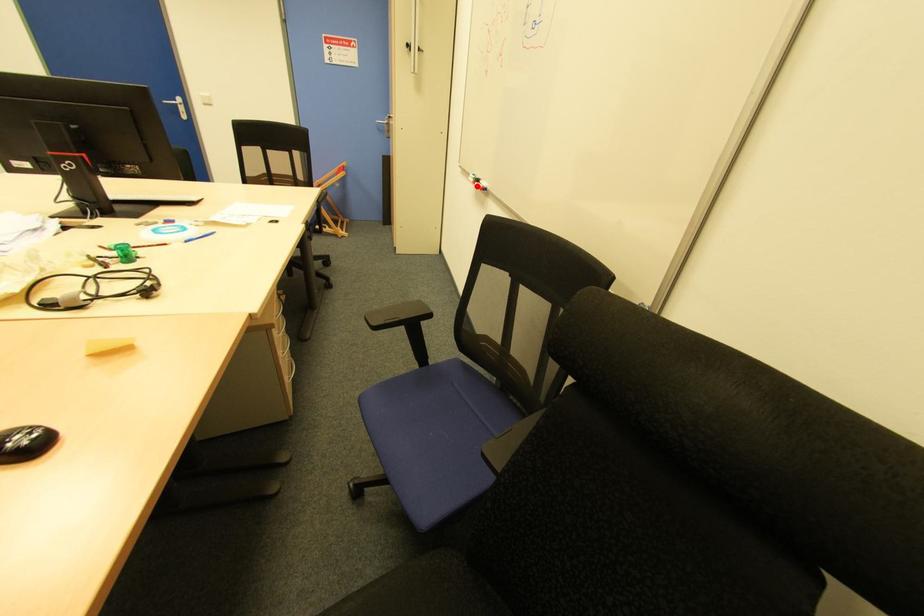
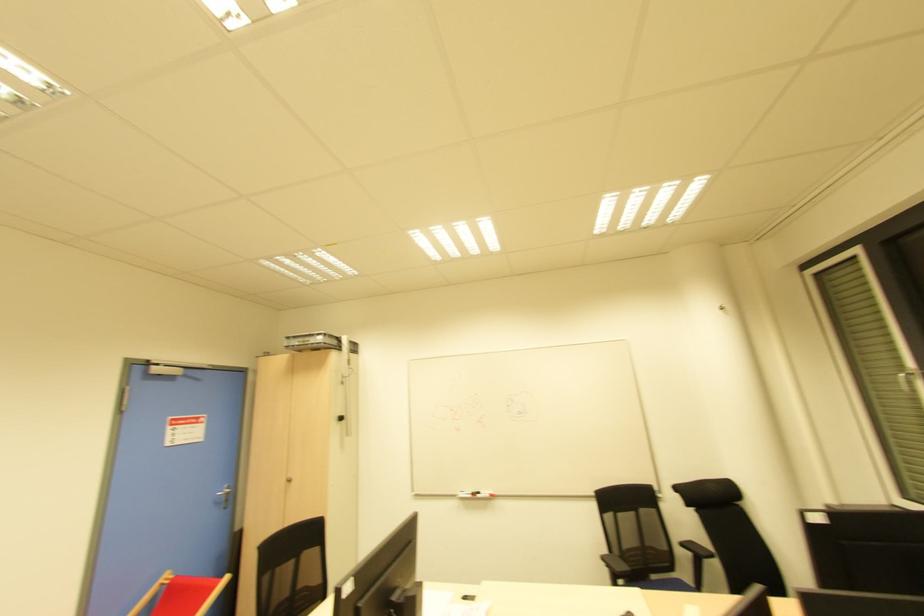
Question: I am providing you with two images of the same scene from different viewpoints. A red point is shown in image1. For the corresponding object point in image2, is it positioned nearer or farther from the camera?

Choices:
 (A) Nearer
 (B) Farther

Answer: (B)